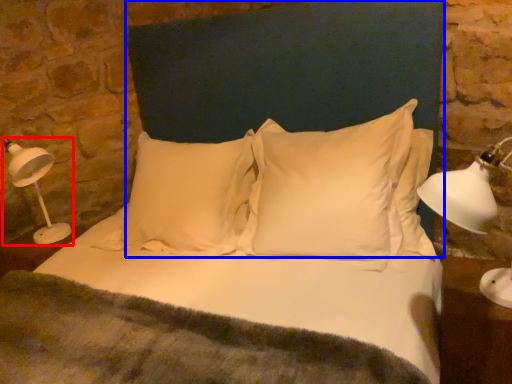
Question: Which object appears closest to the camera in this image, table lamp (highlighted by a red box) or headboard (highlighted by a blue box)?

Choices:
 (A) table lamp
 (B) headboard

Answer: (B)